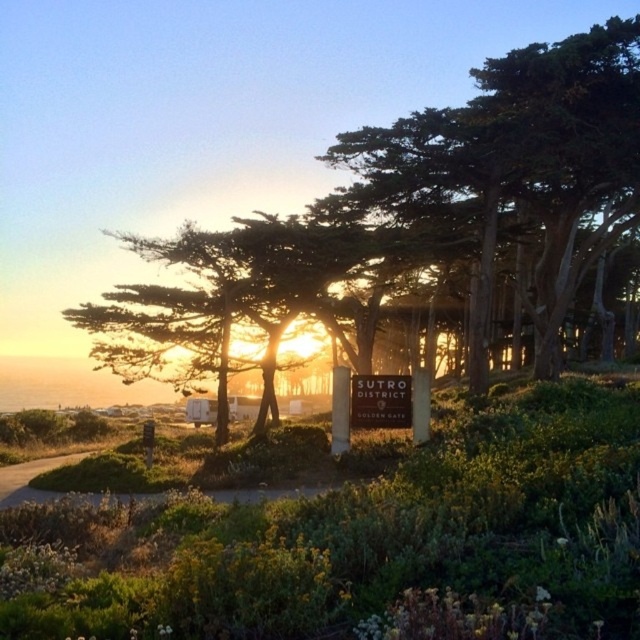
Question: Is green textured tree at center above brown dirt path at lower left?

Choices:
 (A) no
 (B) yes

Answer: (B)

Question: Which point is farther to the camera?

Choices:
 (A) brown dirt path at lower left
 (B) green textured tree at center

Answer: (B)

Question: Can you confirm if green textured tree at center is positioned to the right of white plastic sign at center?

Choices:
 (A) no
 (B) yes

Answer: (B)

Question: Which of the following is the closest to the observer?

Choices:
 (A) (593, 45)
 (B) (365, 390)
 (C) (13, 497)

Answer: (C)

Question: Is the position of white plastic sign at center more distant than that of brown dirt path at lower left?

Choices:
 (A) no
 (B) yes

Answer: (B)

Question: Among these points, which one is farthest from the camera?

Choices:
 (A) (376, 384)
 (B) (371, 353)

Answer: (B)